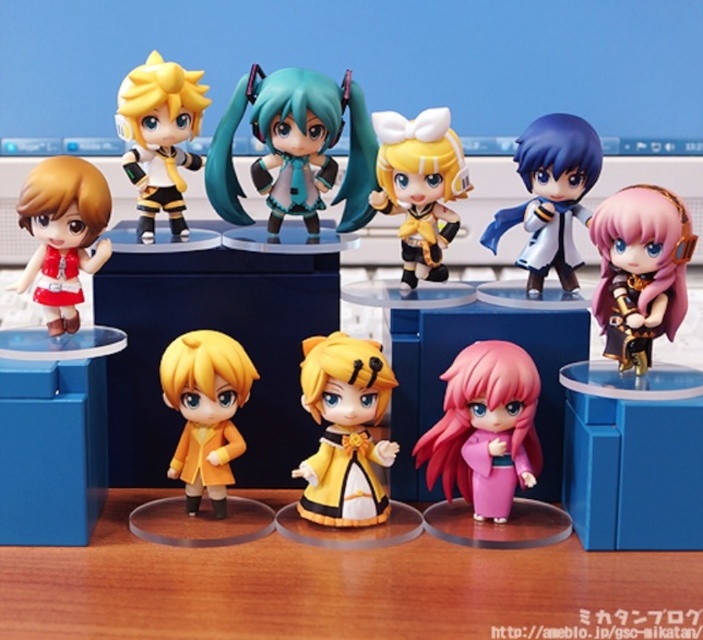
Question: Considering the relative positions of wooden table at lower center and satin blue coat at upper right in the image provided, where is wooden table at lower center located with respect to satin blue coat at upper right?

Choices:
 (A) right
 (B) left

Answer: (B)

Question: Which object is the farthest from the teal matte figure at center?

Choices:
 (A) shiny purple hair at upper right
 (B) pink matte kimono at center
 (C) blue plastic table at lower left

Answer: (A)

Question: Among these objects, which one is farthest from the camera?

Choices:
 (A) pink matte kimono at center
 (B) matte red dress at left

Answer: (B)

Question: Can you confirm if wooden table at lower center is thinner than blue plastic table at lower right?

Choices:
 (A) yes
 (B) no

Answer: (B)

Question: Is blue plastic table at lower left wider than pink matte kimono at center?

Choices:
 (A) no
 (B) yes

Answer: (B)

Question: Which point appears farthest from the camera in this image?

Choices:
 (A) 202,403
 (B) 638,401
 (C) 408,125
 (D) 217,588

Answer: (C)